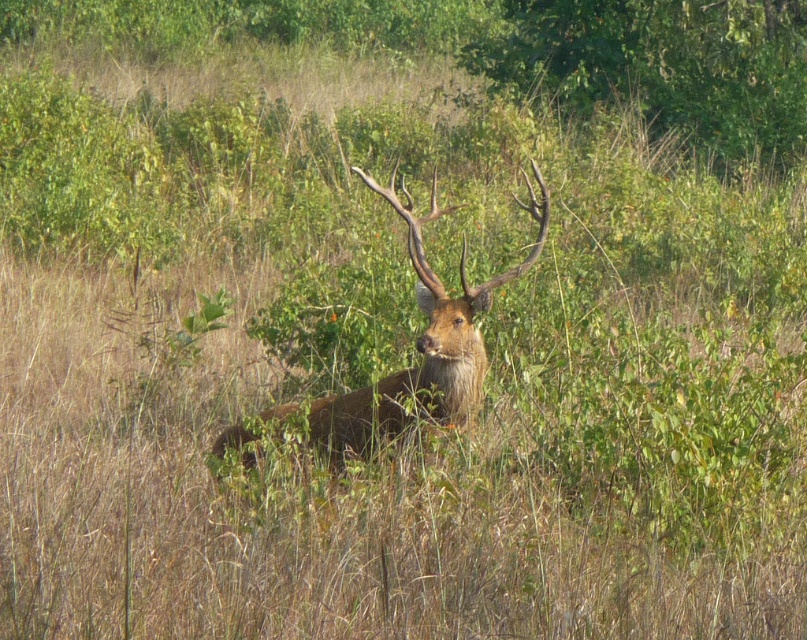
Is green leafy bush at upper center below brown furry deer at center?

Actually, green leafy bush at upper center is above brown furry deer at center.

Who is lower down, green leafy bush at upper center or brown furry deer at center?

brown furry deer at center is below.

This screenshot has height=640, width=807. What are the coordinates of `green leafy bush at upper center` in the screenshot? It's located at tap(665, 65).